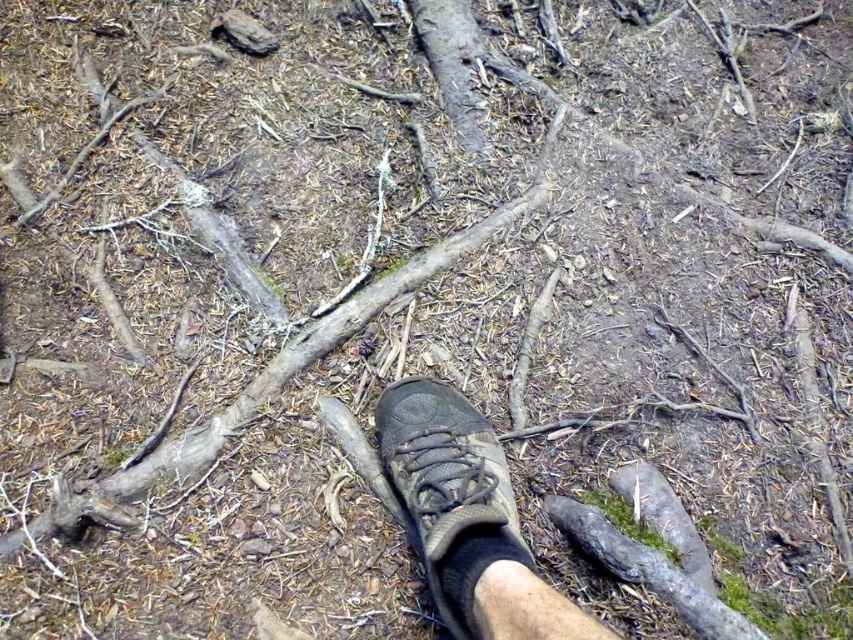
You are a hiker trying to place your brown suede shoe at center on top of the brown rough wood at center. Based on the scene description, will the shoe fit entirely on the wood without hanging over the edges?

The brown suede shoe at center has a smaller size compared to brown rough wood at center, so the shoe will fit entirely on the wood without hanging over the edges.

You are standing above the forest floor and see two points marked on the ground. Which point is closer to you, point (541, 618) or point (450, 264)?

Point (541, 618) is closer to the viewer than point (450, 264).